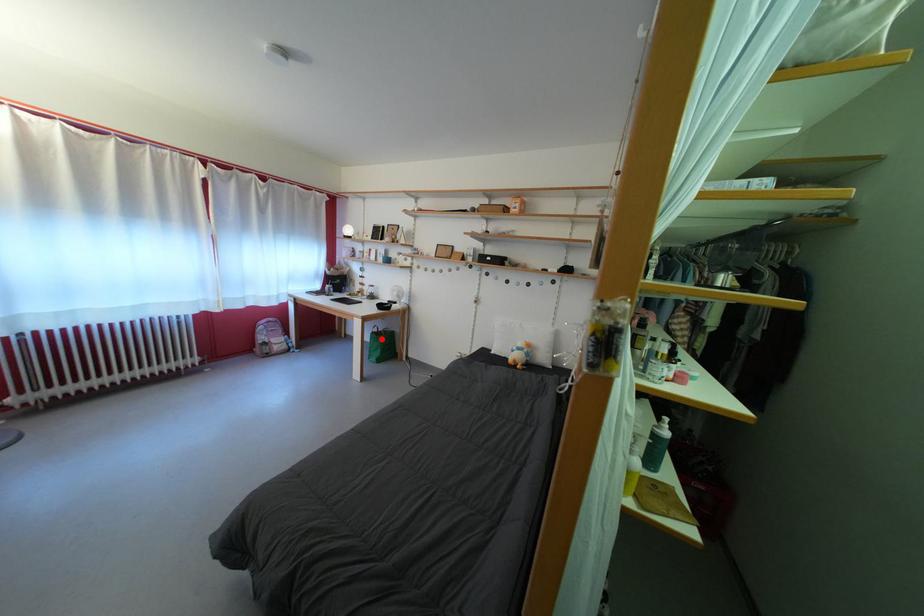
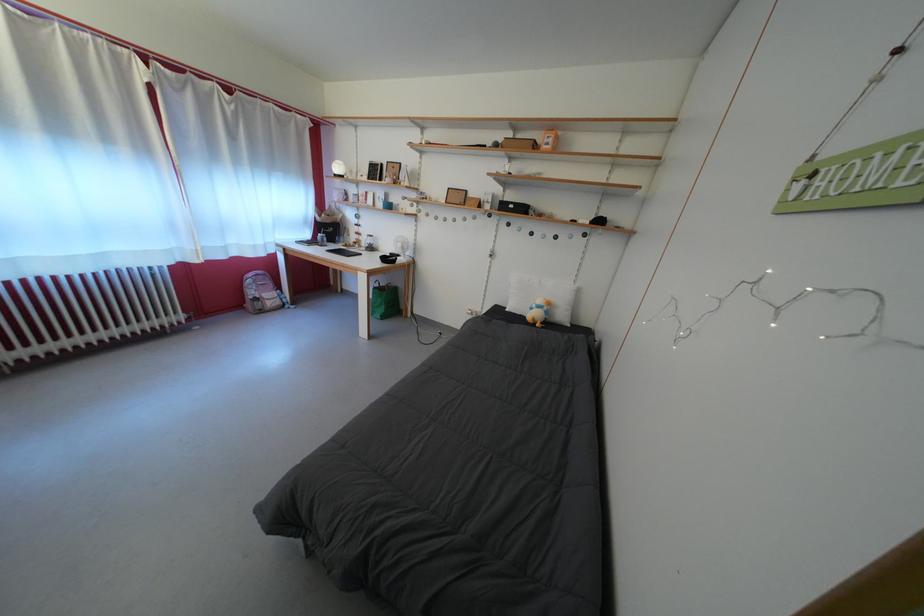
Question: I am providing you with two images of the same scene from different viewpoints. A red point is marked on the first image. Is the red point's position out of view in image 2?

Choices:
 (A) Yes
 (B) No

Answer: (B)